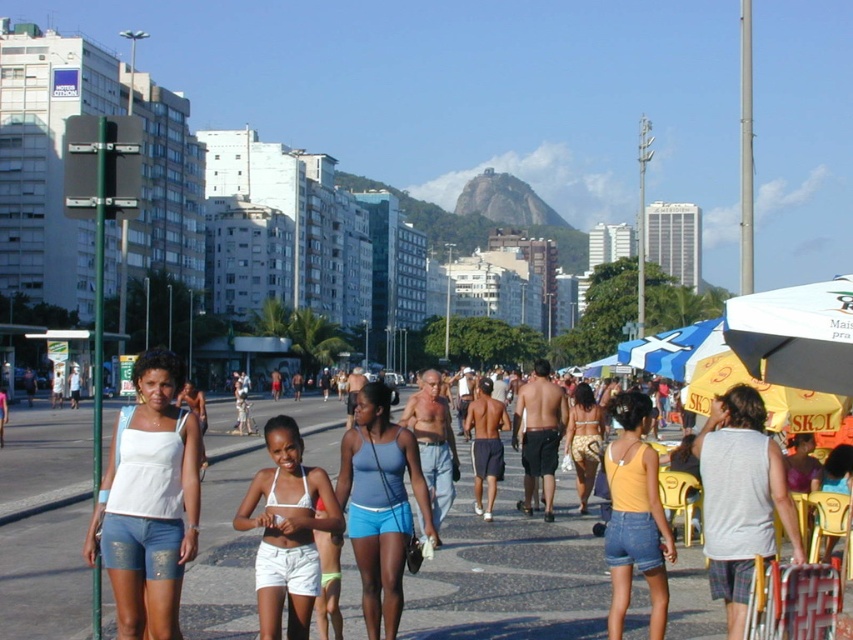
This screenshot has height=640, width=853. What do you see at coordinates (287, 531) in the screenshot?
I see `white cotton tank top at center` at bounding box center [287, 531].

Is point (311, 532) behind point (583, 474)?

No, it is in front of (583, 474).

Between point (297, 461) and point (592, 410), which one is positioned in front?

Point (297, 461) is more forward.

You are a GUI agent. You are given a task and a screenshot of the screen. Output one action in this format:
    pyautogui.click(x=<x>, y=<y>)
    Task: Click on the white cotton tank top at center
    The height and width of the screenshot is (640, 853).
    Given the screenshot: What is the action you would take?
    pyautogui.click(x=287, y=531)

Is white matte shorts at center wider than white cotton tank top at center?

Indeed, white matte shorts at center has a greater width compared to white cotton tank top at center.

Does white matte shorts at center come in front of white cotton tank top at center?

That is True.

Where is `white matte shorts at center`? white matte shorts at center is located at coordinates (148, 500).

At what (x,y) coordinates should I click in order to perform the action: click on white matte shorts at center. Please return your answer as a coordinate pair (x, y). The height and width of the screenshot is (640, 853). Looking at the image, I should click on (148, 500).

Between white cotton tank top at center and yellow denim shorts at center, which one is positioned lower?

white cotton tank top at center is below.

Between point (277, 452) and point (619, 513), which one is positioned in front?

Positioned in front is point (277, 452).

Does point (242, 500) come in front of point (645, 397)?

Yes, it is.

Locate an element on the screen. The height and width of the screenshot is (640, 853). white cotton tank top at center is located at coordinates tap(287, 531).